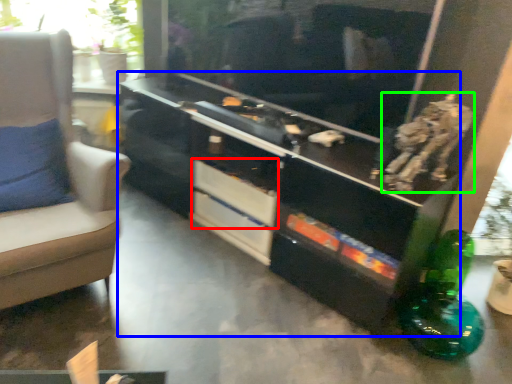
Question: Which is farther away from drawer (highlighted by a red box)? entertainment center (highlighted by a blue box) or animal (highlighted by a green box)?

Choices:
 (A) entertainment center
 (B) animal

Answer: (B)